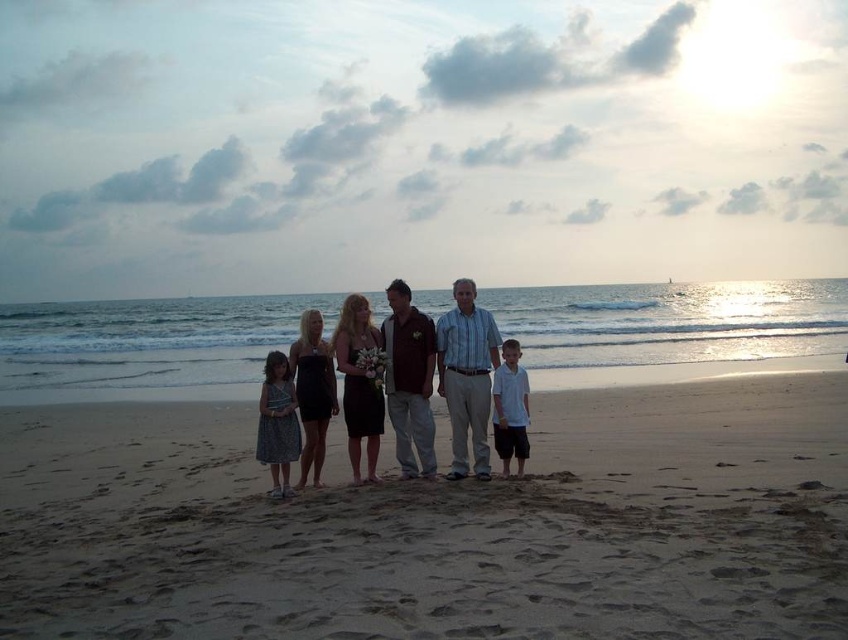
You are standing at the position of point (506, 378) and want to walk to the shoreline. There is a seagull flying at point (802, 529). Will the seagull be between you and the shoreline when you start walking?

Point (802, 529) is in front of point (506, 378), so the seagull at point (802, 529) will be between you and the shoreline when you start walking.

You are a photographer trying to capture a group photo of the light brown sand at center and the white cotton shirt at center. Which object is located to the right of the other?

The light brown sand at center is positioned on the right side of white cotton shirt at center.